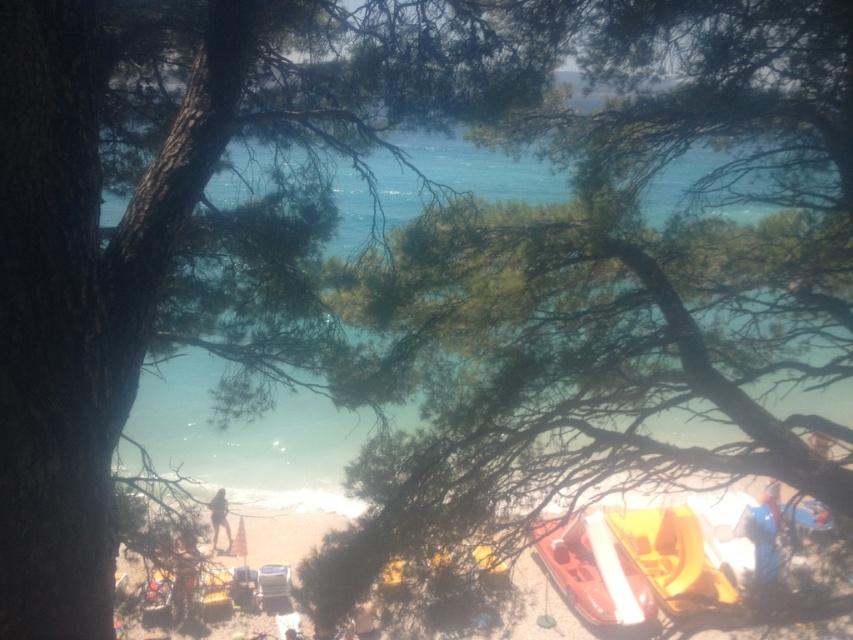
Question: Among these objects, which one is farthest from the camera?

Choices:
 (A) light brown sand at lower center
 (B) matte orange kayak at lower center
 (C) yellow plastic boat at lower right

Answer: (A)

Question: Is matte orange kayak at lower center thinner than orange fabric person at lower center?

Choices:
 (A) yes
 (B) no

Answer: (B)

Question: Which point is closer to the camera?

Choices:
 (A) yellow plastic boat at lower right
 (B) light brown sand at lower center

Answer: (A)

Question: Observing the image, what is the correct spatial positioning of yellow plastic boat at lower right in reference to light brown sand at lower center?

Choices:
 (A) above
 (B) below

Answer: (B)

Question: Considering the relative positions of yellow plastic boat at lower right and light brown sand at lower center in the image provided, where is yellow plastic boat at lower right located with respect to light brown sand at lower center?

Choices:
 (A) right
 (B) left

Answer: (A)

Question: Which object is closer to the camera taking this photo?

Choices:
 (A) orange fabric person at lower center
 (B) light brown sand at lower center
 (C) matte orange kayak at lower center
 (D) yellow plastic boat at lower right

Answer: (A)